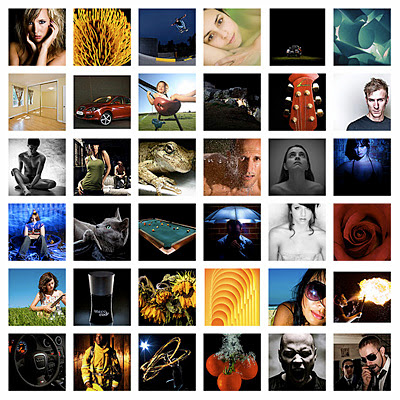
This screenshot has width=400, height=400. I want to click on snooker balls, so click(146, 224), click(148, 224), click(155, 226), click(158, 220), click(160, 222), click(163, 223), click(169, 225), click(176, 227), click(187, 230).